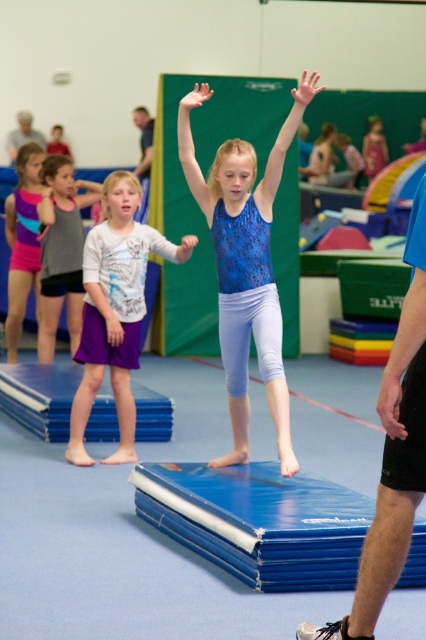
Who is more distant from viewer, (115, 296) or (28, 132)?

Point (28, 132)

Is purple cotton skirt at left wider than gray fabric shirt at upper left?

Correct, the width of purple cotton skirt at left exceeds that of gray fabric shirt at upper left.

Who is more distant from viewer, (89, 317) or (40, 145)?

The point (40, 145) is behind.

Identify the location of purple cotton skirt at left. The height and width of the screenshot is (640, 426). (115, 310).

Does matte purple shorts at left appear under gray fabric shirt at upper left?

Indeed, matte purple shorts at left is positioned under gray fabric shirt at upper left.

Does matte purple shorts at left appear over gray fabric shirt at upper left?

Actually, matte purple shorts at left is below gray fabric shirt at upper left.

Describe the element at coordinates (23, 243) in the screenshot. I see `matte purple shorts at left` at that location.

This screenshot has width=426, height=640. Find the location of `matte purple shorts at left`. matte purple shorts at left is located at coordinates (23, 243).

Does blue fabric gymnast at center appear on the right side of gray fabric tank top at left?

Correct, you'll find blue fabric gymnast at center to the right of gray fabric tank top at left.

What do you see at coordinates (239, 164) in the screenshot?
I see `blue fabric gymnast at center` at bounding box center [239, 164].

Image resolution: width=426 pixels, height=640 pixels. Find the location of `blue fabric gymnast at center`. blue fabric gymnast at center is located at coordinates (239, 164).